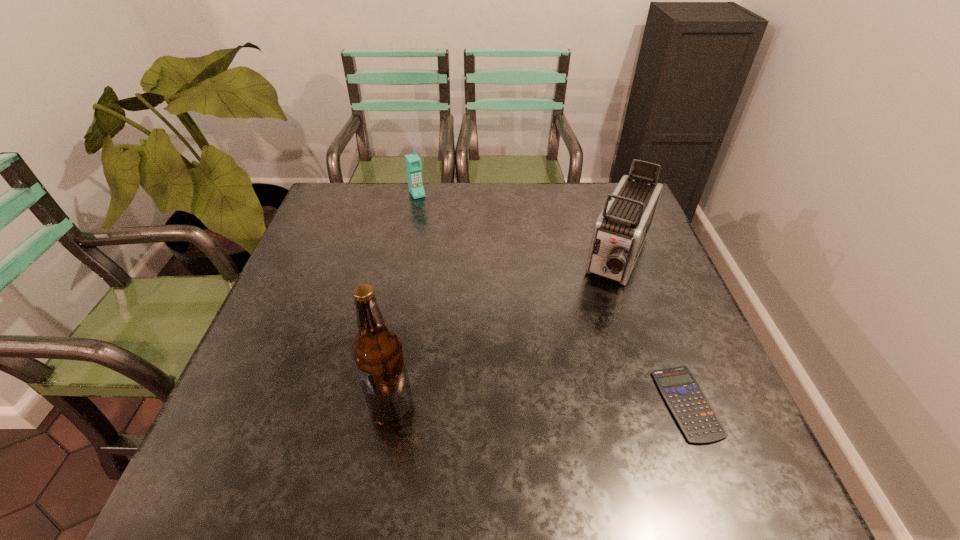
Identify the location of beer bottle. This screenshot has height=540, width=960. (377, 350).

Locate an element on the screen. The height and width of the screenshot is (540, 960). calculator is located at coordinates (692, 410).

Where is `camcorder`? This screenshot has height=540, width=960. camcorder is located at coordinates (620, 231).

Where is `the second tallest object`? the second tallest object is located at coordinates pyautogui.click(x=620, y=231).

At what (x,y) coordinates should I click in order to perform the action: click on the third tallest object. Please return your answer as a coordinate pair (x, y). This screenshot has height=540, width=960. Looking at the image, I should click on (413, 162).

Where is `cellular telephone`? This screenshot has width=960, height=540. cellular telephone is located at coordinates (413, 162).

Where is `vacant space located 0.080m on the label of the beer bottle`? This screenshot has height=540, width=960. vacant space located 0.080m on the label of the beer bottle is located at coordinates (330, 405).

Where is `free space located on the label of the beer bottle`? This screenshot has height=540, width=960. free space located on the label of the beer bottle is located at coordinates (239, 405).

You are a GUI agent. You are given a task and a screenshot of the screen. Output one action in this format:
    pyautogui.click(x=<x>, y=<y>)
    Task: Click on the vacant space situated on the label of the beer bottle
    The height and width of the screenshot is (540, 960).
    Given the screenshot: What is the action you would take?
    pyautogui.click(x=244, y=405)

Locate an element on the screen. vacant region located 0.340m on the left of the shortest object is located at coordinates (490, 403).